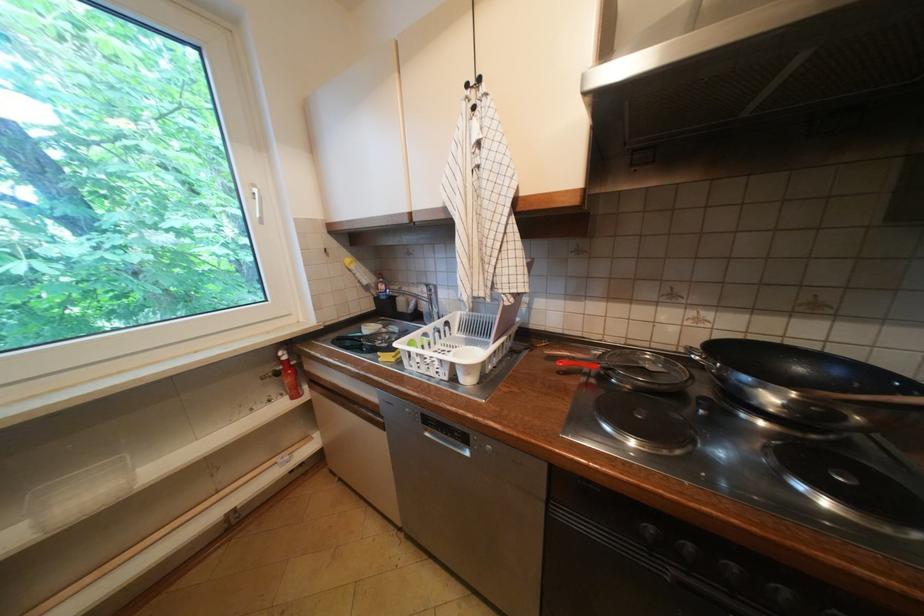
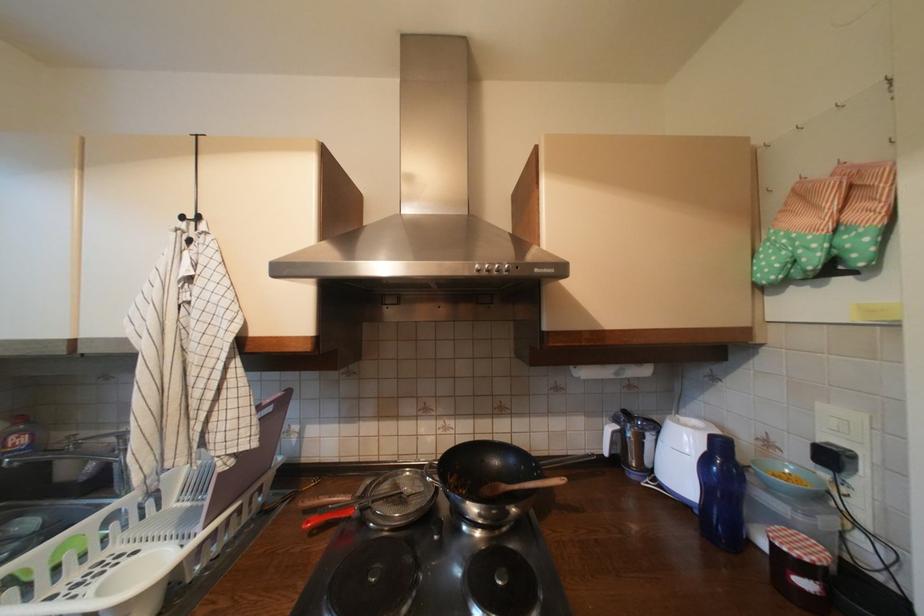
In the second image, find the point that corresponds to (872,399) in the first image.

(525, 488)